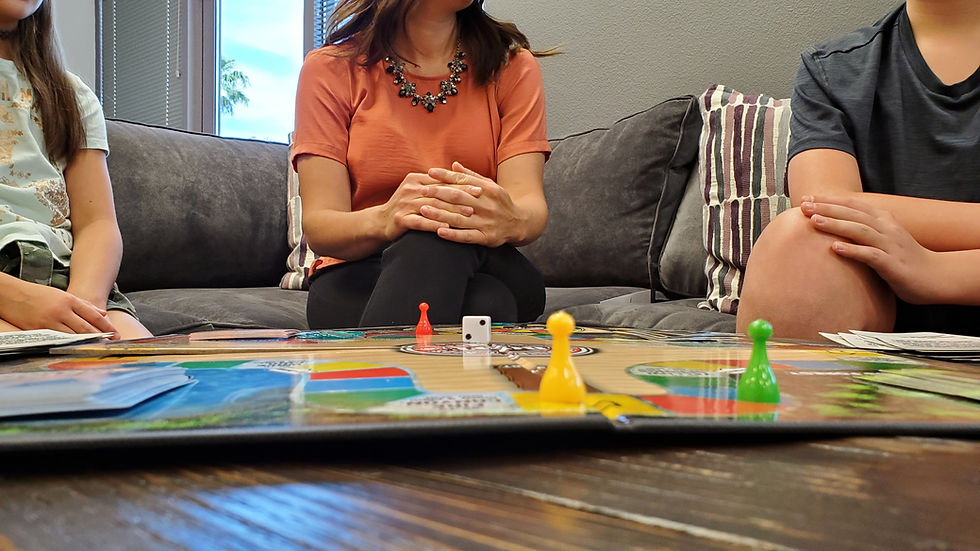
Identify the location of wall. This screenshot has height=551, width=980. (692, 56).